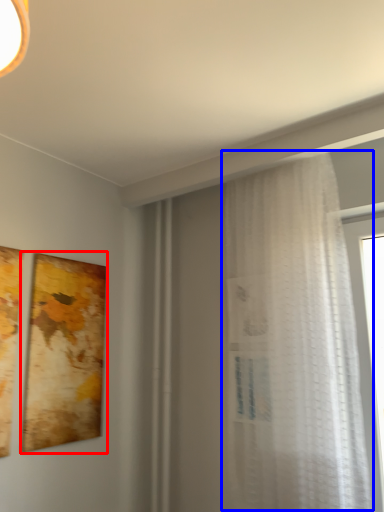
Question: Which point is closer to the camera, picture frame (highlighted by a red box) or curtain (highlighted by a blue box)?

Choices:
 (A) picture frame
 (B) curtain

Answer: (B)